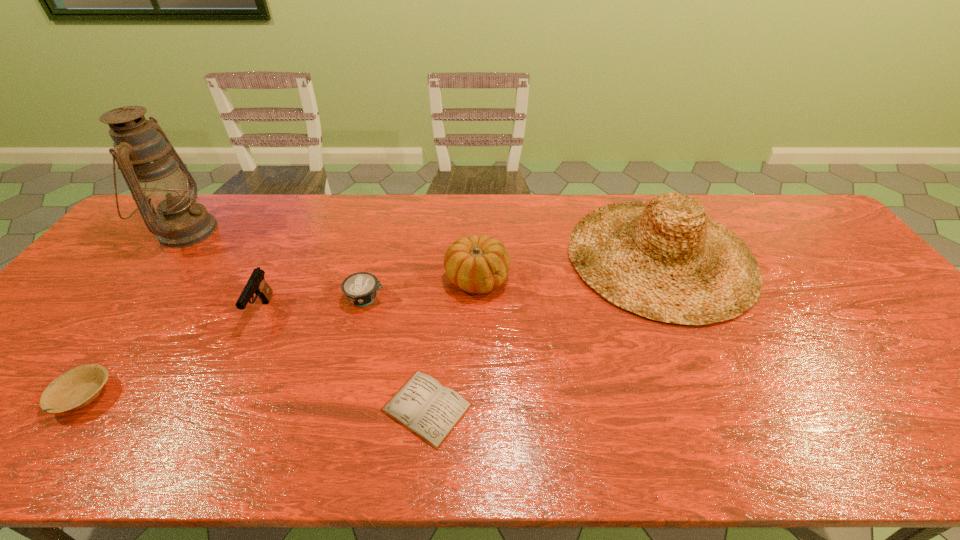
The image size is (960, 540). What are the coordinates of `blank space that satisfies the following two spatial constraints: 1. on the front side of the tallest object; 2. on the right side of the third shortest object` in the screenshot? It's located at (133, 298).

At what (x,y) coordinates should I click in order to perform the action: click on vacant space that satisfies the following two spatial constraints: 1. on the back side of the sixth shortest object; 2. on the left side of the shortest object. Please return your answer as a coordinate pair (x, y). This screenshot has width=960, height=540. Looking at the image, I should click on (442, 256).